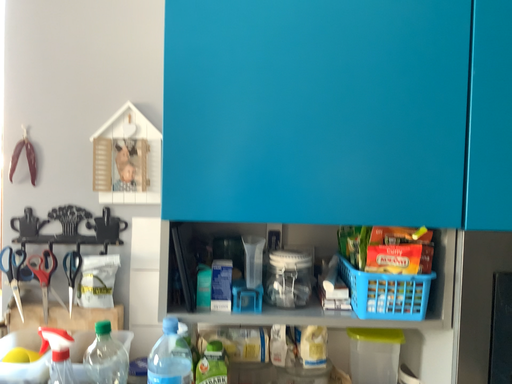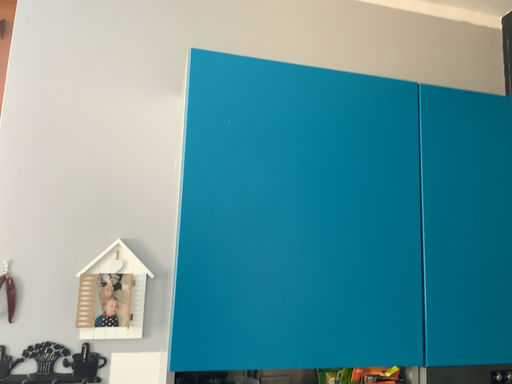
Question: How did the camera likely rotate when shooting the video?

Choices:
 (A) rotated right
 (B) rotated left

Answer: (A)